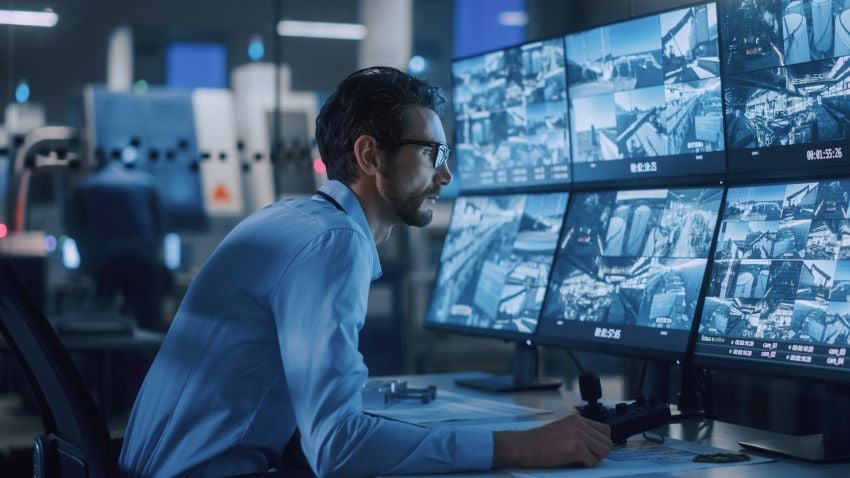
Locate an element on the screen. monitors is located at coordinates click(x=792, y=262), click(x=774, y=81), click(x=626, y=106), click(x=530, y=111), click(x=485, y=284), click(x=636, y=282).